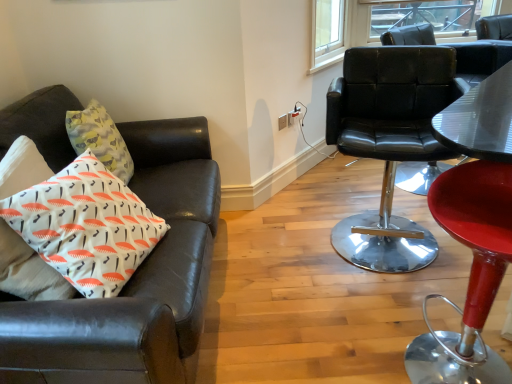
Where is `empty space that is to the right of leather couch at left, acting as the 1th chair starting from the left`? empty space that is to the right of leather couch at left, acting as the 1th chair starting from the left is located at coordinates (297, 274).